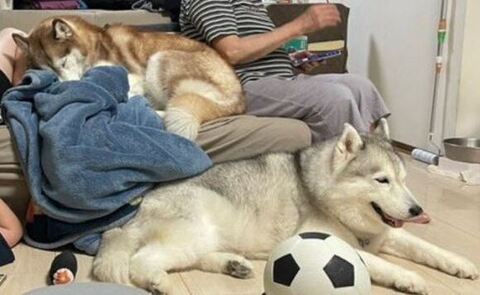
The width and height of the screenshot is (480, 295). In order to click on dog bowl in this screenshot , I will do `click(471, 146)`.